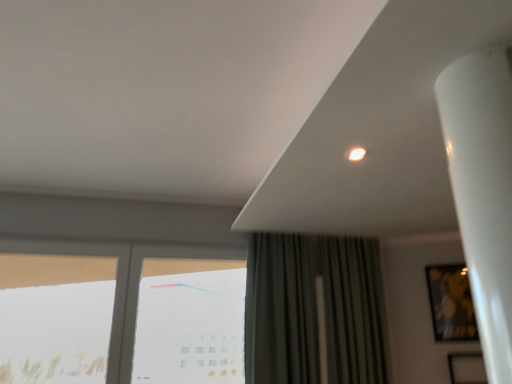
Question: Considering the positions of transparent glass window at center, marked as the 3th window in a left-to-right arrangement, and transparent glass window at left, positioned as the 1th window in left-to-right order, in the image, is transparent glass window at center, marked as the 3th window in a left-to-right arrangement, bigger or smaller than transparent glass window at left, positioned as the 1th window in left-to-right order,?

Choices:
 (A) big
 (B) small

Answer: (A)

Question: From the image's perspective, is transparent glass window at center, marked as the 3th window in a left-to-right arrangement, above or below transparent glass window at left, placed as the third window when sorted from right to left?

Choices:
 (A) below
 (B) above

Answer: (A)

Question: Estimate the real-world distances between objects in this image. Which object is closer to the dark green fabric curtain at center?

Choices:
 (A) transparent glass window at center, marked as the 3th window in a left-to-right arrangement
 (B) transparent glass window at lower left, marked as the second window in a right-to-left arrangement
 (C) transparent glass window at left, placed as the third window when sorted from right to left
 (D) metallic gold picture frame at right

Answer: (A)

Question: Which of these objects is positioned closest to the dark green fabric curtain at center?

Choices:
 (A) metallic gold picture frame at right
 (B) transparent glass window at lower left, the second window positioned from the left
 (C) transparent glass window at center, marked as the 3th window in a left-to-right arrangement
 (D) transparent glass window at left, positioned as the 1th window in left-to-right order

Answer: (C)